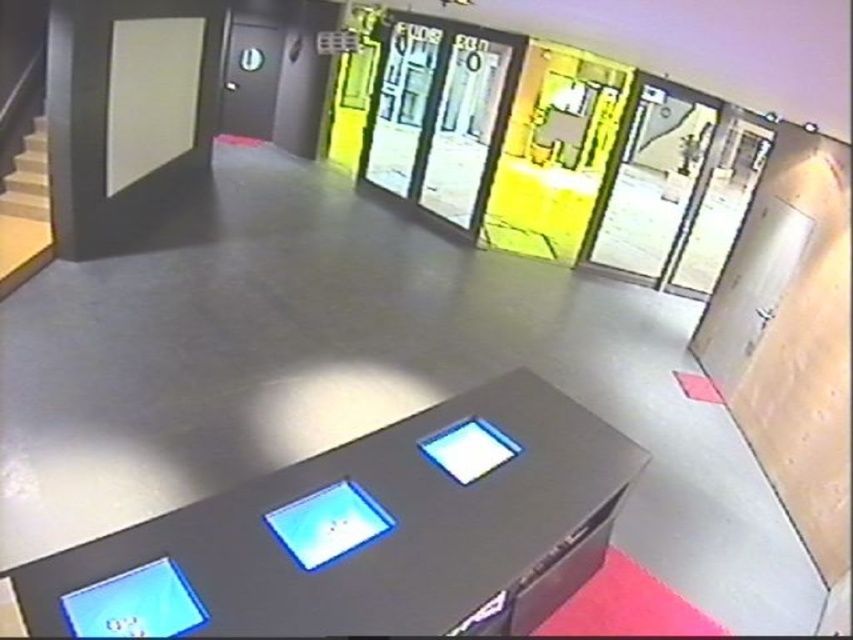
Question: Which of the following is the closest to the observer?

Choices:
 (A) wooden stairs at left
 (B) metallic gray table at center

Answer: (B)

Question: Can you confirm if metallic gray table at center is smaller than wooden stairs at left?

Choices:
 (A) no
 (B) yes

Answer: (A)

Question: Which object is farther from the camera taking this photo?

Choices:
 (A) metallic gray table at center
 (B) wooden stairs at left

Answer: (B)

Question: In this image, where is metallic gray table at center located relative to wooden stairs at left?

Choices:
 (A) left
 (B) right

Answer: (B)

Question: Does metallic gray table at center lie in front of wooden stairs at left?

Choices:
 (A) yes
 (B) no

Answer: (A)

Question: Which object appears farthest from the camera in this image?

Choices:
 (A) wooden stairs at left
 (B) metallic gray table at center

Answer: (A)